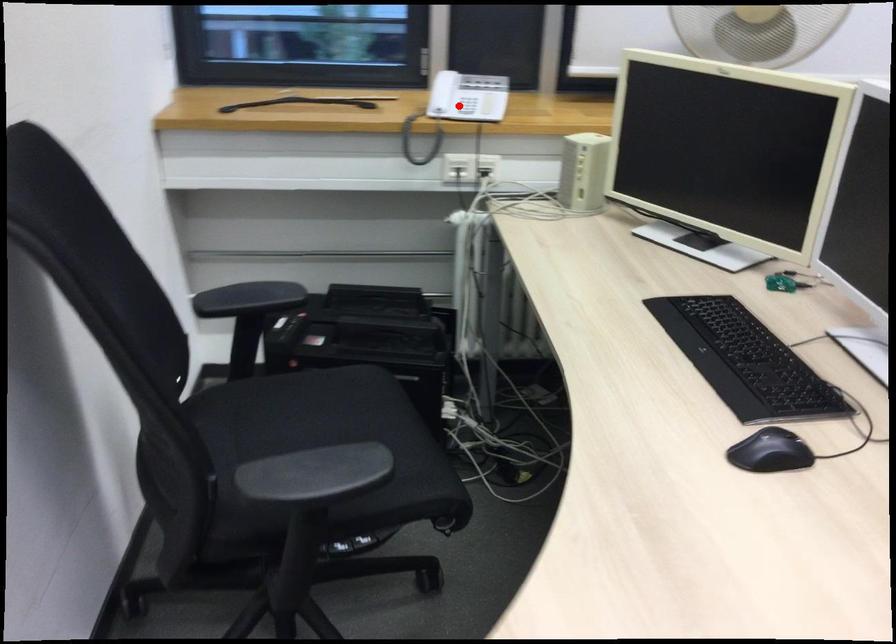
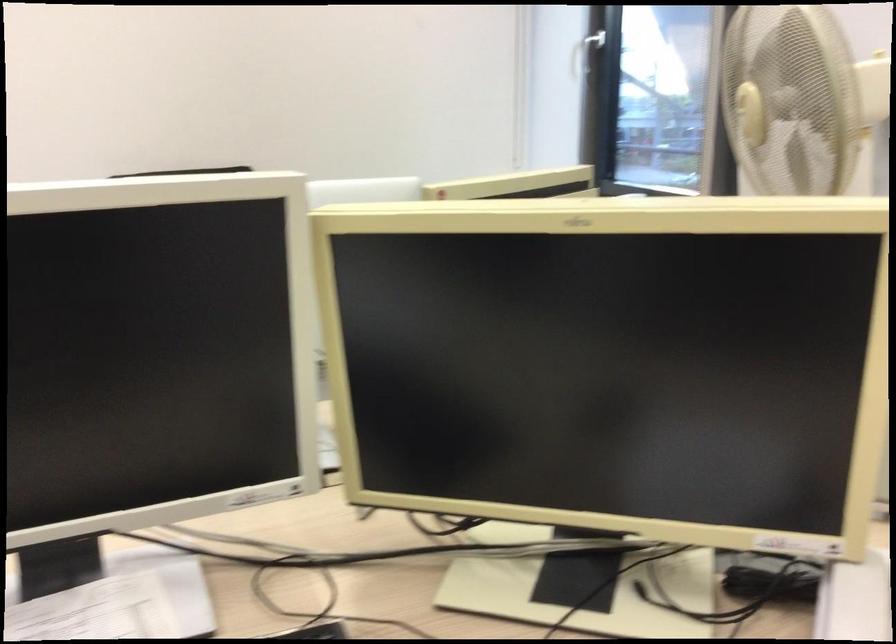
Question: I am providing you with two images of the same scene from different viewpoints. A red point is marked on the first image. Is the red point's position out of view in image 2?

Choices:
 (A) Yes
 (B) No

Answer: (A)